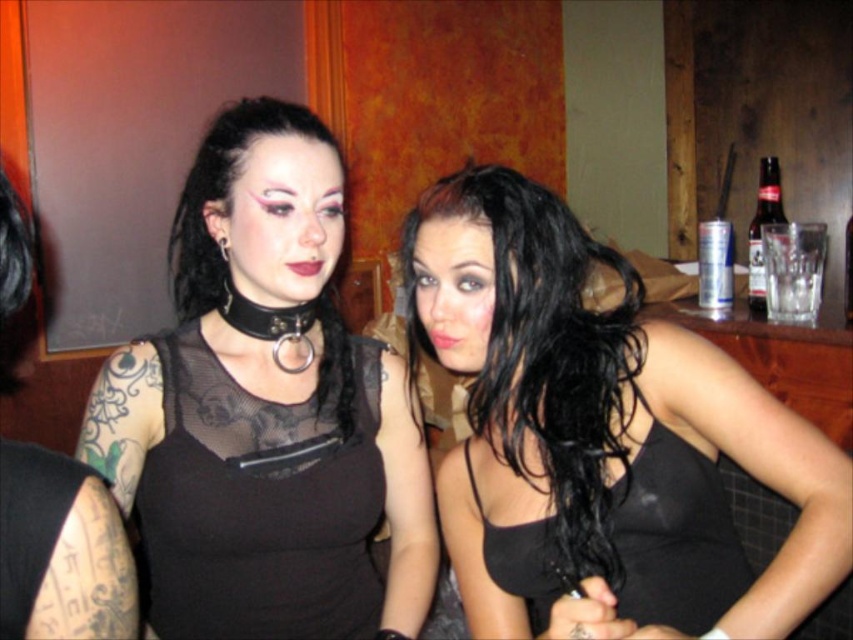
Question: Which is farther from the black matte tank top at center?

Choices:
 (A) black mesh dress at center
 (B) matte black top at center
 (C) brown glass bottle at upper right
 (D) black satin dress at center

Answer: (C)

Question: Which point appears closest to the camera in this image?

Choices:
 (A) (704, 477)
 (B) (245, 484)

Answer: (A)

Question: Is matte black top at center positioned behind black leather choker at upper center?

Choices:
 (A) yes
 (B) no

Answer: (B)

Question: Which object is farther from the camera taking this photo?

Choices:
 (A) black leather choker at upper center
 (B) matte black top at center
 (C) black satin dress at center

Answer: (A)

Question: Does matte black top at center lie in front of black leather choker at upper center?

Choices:
 (A) yes
 (B) no

Answer: (A)

Question: Does matte black top at center appear on the left side of black mesh dress at center?

Choices:
 (A) no
 (B) yes

Answer: (B)